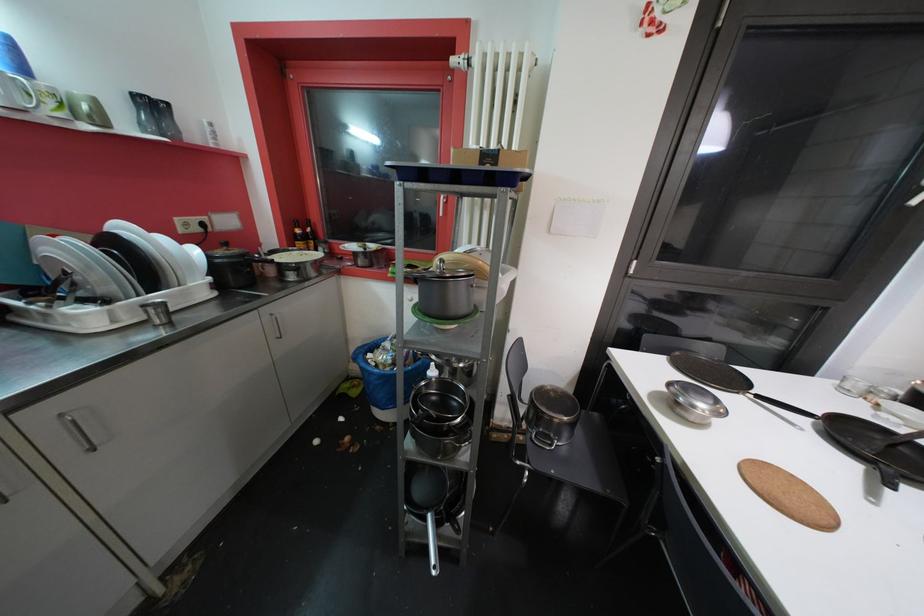
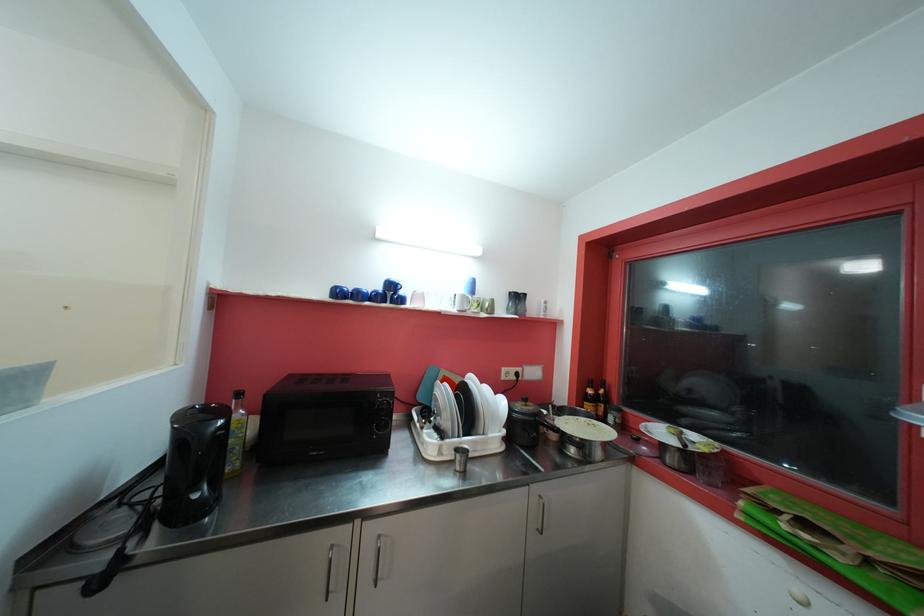
In the second image, find the point that corresponds to (x=150, y=309) in the first image.

(462, 452)